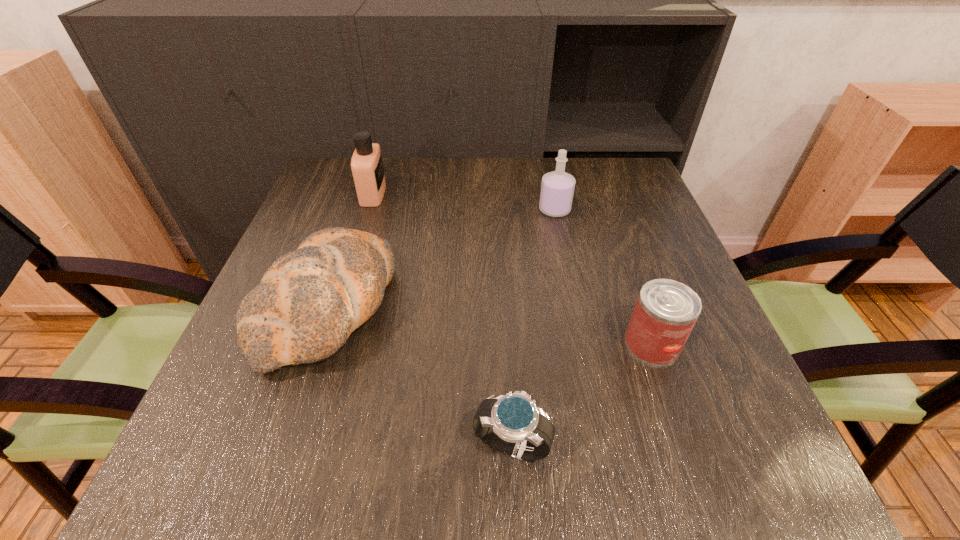
This screenshot has height=540, width=960. Find the location of `free space at the near left corner`. free space at the near left corner is located at coordinates (221, 484).

Identify the location of blank space at the far right corner of the desktop. (626, 190).

Identify the location of vacant space at the near right corner. (749, 444).

At what (x,y) coordinates should I click in order to perform the action: click on free spot between the can and the right perfume. Please return your answer as a coordinate pair (x, y). Looking at the image, I should click on (603, 277).

Image resolution: width=960 pixels, height=540 pixels. Identify the location of unoccupied position between the bread and the right perfume. (442, 258).

Identify the location of free point between the third object from right to left and the can. (582, 394).

At what (x,y) coordinates should I click in order to perform the action: click on unoccupied position between the can and the nearest object. Please return your answer as a coordinate pair (x, y). This screenshot has height=540, width=960. Looking at the image, I should click on (582, 394).

Locate an element on the screen. The image size is (960, 540). empty location between the left perfume and the right perfume is located at coordinates [464, 202].

This screenshot has width=960, height=540. I want to click on vacant space in between the can and the left perfume, so 513,269.

Where is `vacant region between the nearest object and the second object from right to left`? The image size is (960, 540). vacant region between the nearest object and the second object from right to left is located at coordinates (533, 327).